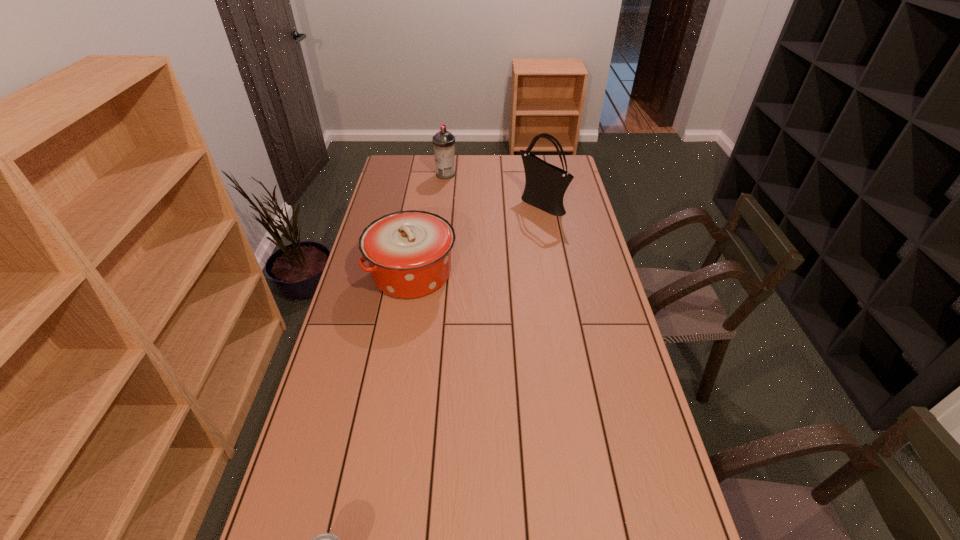
Image resolution: width=960 pixels, height=540 pixels. Find the location of `object that is at the left edge`. object that is at the left edge is located at coordinates (409, 252).

Where is `object present at the right edge`? The height and width of the screenshot is (540, 960). object present at the right edge is located at coordinates (545, 184).

This screenshot has height=540, width=960. In order to click on free space at the far edge of the desktop in this screenshot , I will do `click(487, 173)`.

Identify the location of free space at the left edge of the desktop. Image resolution: width=960 pixels, height=540 pixels. tap(402, 199).

The height and width of the screenshot is (540, 960). I want to click on vacant space at the right edge of the desktop, so click(x=575, y=276).

Identify the location of vacant space in between the aerosol can and the rightmost object. The image size is (960, 540). (493, 190).

Where is `empty location between the casserole and the shoulder bag`? The height and width of the screenshot is (540, 960). empty location between the casserole and the shoulder bag is located at coordinates (477, 239).

Where is `free space that is in between the third shortest object and the shoulder bag`? free space that is in between the third shortest object and the shoulder bag is located at coordinates (493, 190).

Locate an element on the screen. object that is the third closest to the casserole is located at coordinates (324, 539).

Identify which object is the closest to the farthest object. Please provide its 2D coordinates. Your answer should be formatted as a tuple, i.e. [(x, y)], where the tuple contains the x and y coordinates of a point satisfying the conditions above.

[(545, 184)]